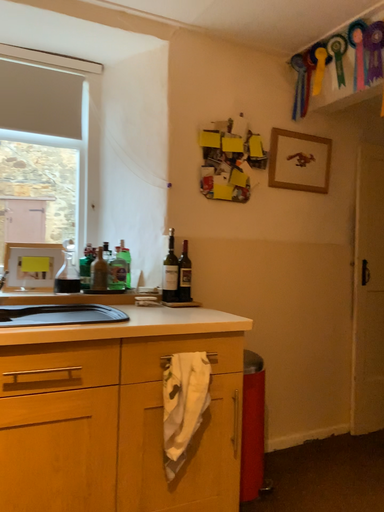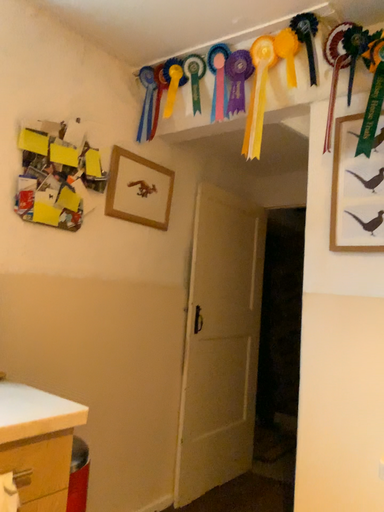
Question: Which way did the camera rotate in the video?

Choices:
 (A) rotated left
 (B) rotated right

Answer: (B)